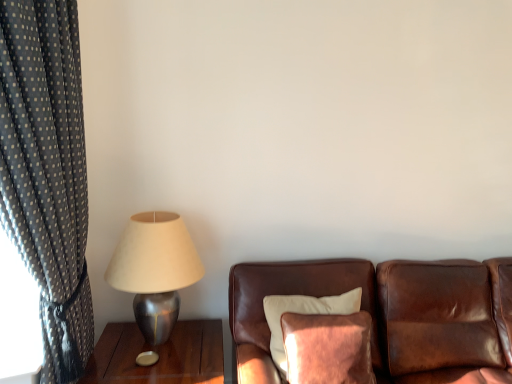
Question: Is the position of metallic silver table at left more distant than that of velvet brown pillow at center?

Choices:
 (A) no
 (B) yes

Answer: (B)

Question: Is metallic silver table at left at the right side of velvet brown pillow at center?

Choices:
 (A) yes
 (B) no

Answer: (B)

Question: From a real-world perspective, is metallic silver table at left on velvet brown pillow at center?

Choices:
 (A) no
 (B) yes

Answer: (A)

Question: Are metallic silver table at left and velvet brown pillow at center making contact?

Choices:
 (A) yes
 (B) no

Answer: (B)

Question: From the image's perspective, is metallic silver table at left on top of velvet brown pillow at center?

Choices:
 (A) yes
 (B) no

Answer: (B)

Question: Considering the positions of brown leather couch at center and metallic silver table at left in the image, is brown leather couch at center taller or shorter than metallic silver table at left?

Choices:
 (A) tall
 (B) short

Answer: (A)

Question: Is brown leather couch at center bigger or smaller than metallic silver table at left?

Choices:
 (A) small
 (B) big

Answer: (B)

Question: Considering the relative positions of brown leather couch at center and metallic silver table at left in the image provided, is brown leather couch at center to the left or to the right of metallic silver table at left?

Choices:
 (A) right
 (B) left

Answer: (A)

Question: Is brown leather couch at center inside or outside of metallic silver table at left?

Choices:
 (A) outside
 (B) inside

Answer: (A)

Question: Based on their sizes in the image, would you say dark gray polka dot fabric at left is bigger or smaller than metallic silver table at left?

Choices:
 (A) small
 (B) big

Answer: (B)

Question: From a real-world perspective, is dark gray polka dot fabric at left physically located above or below metallic silver table at left?

Choices:
 (A) below
 (B) above

Answer: (B)

Question: From the image's perspective, relative to metallic silver table at left, is dark gray polka dot fabric at left above or below?

Choices:
 (A) below
 (B) above

Answer: (B)

Question: Considering the positions of point (69, 231) and point (138, 367), is point (69, 231) closer or farther from the camera than point (138, 367)?

Choices:
 (A) farther
 (B) closer

Answer: (B)

Question: From a real-world perspective, is metallic silver table at left positioned above or below brown leather couch at center?

Choices:
 (A) above
 (B) below

Answer: (B)

Question: Is metallic silver table at left taller or shorter than brown leather couch at center?

Choices:
 (A) short
 (B) tall

Answer: (A)